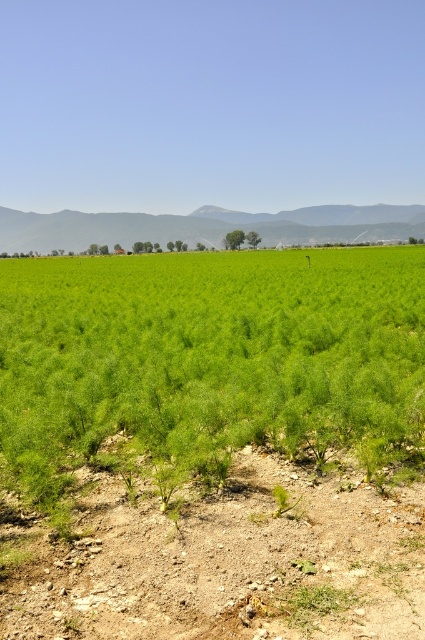
You are a farmer inspecting your field. You see the green leafy grass at center and the dusty brown soil at lower center. Which object is positioned to the left side of the other?

The green leafy grass at center is to the left of dusty brown soil at lower center.